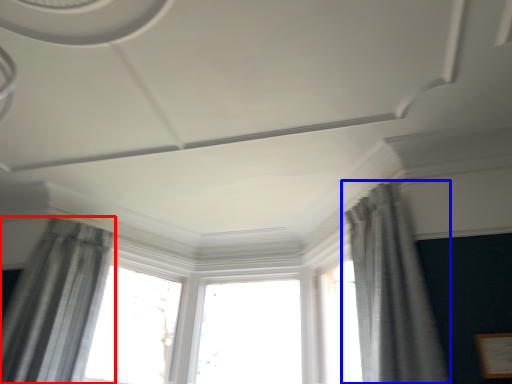
Question: Which object is closer to the camera taking this photo, curtain (highlighted by a red box) or curtain (highlighted by a blue box)?

Choices:
 (A) curtain
 (B) curtain

Answer: (B)